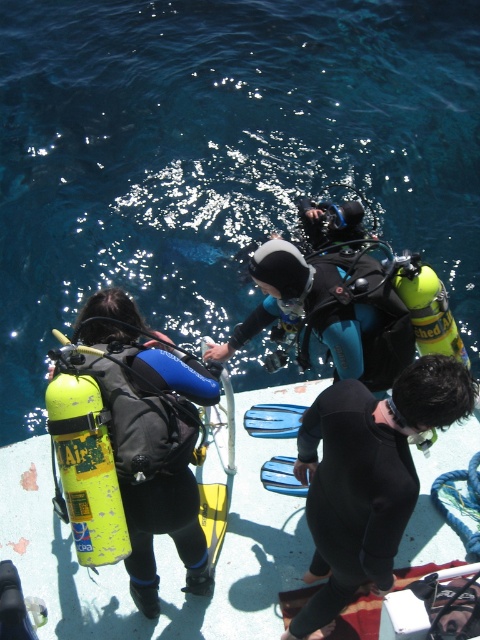
Question: Observing the image, what is the correct spatial positioning of blue water at upper center in reference to matte yellow scuba tank at left?

Choices:
 (A) right
 (B) left

Answer: (A)

Question: Which of the following is the closest to the observer?

Choices:
 (A) black matte wetsuit at center
 (B) matte black wetsuit at center
 (C) blue water at upper center
 (D) matte yellow scuba tank at left

Answer: (A)

Question: Is black matte wetsuit at center further to camera compared to matte yellow scuba tank at left?

Choices:
 (A) no
 (B) yes

Answer: (A)

Question: From the image, what is the correct spatial relationship of black matte wetsuit at center in relation to matte yellow scuba tank at left?

Choices:
 (A) below
 (B) above

Answer: (A)

Question: Among these points, which one is nearest to the camera?

Choices:
 (A) (360, 556)
 (B) (139, 252)
 (C) (396, 320)
 (D) (139, 490)

Answer: (A)

Question: Which of the following is the closest to the observer?

Choices:
 (A) (284, 276)
 (B) (261, 387)
 (C) (192, 417)

Answer: (C)